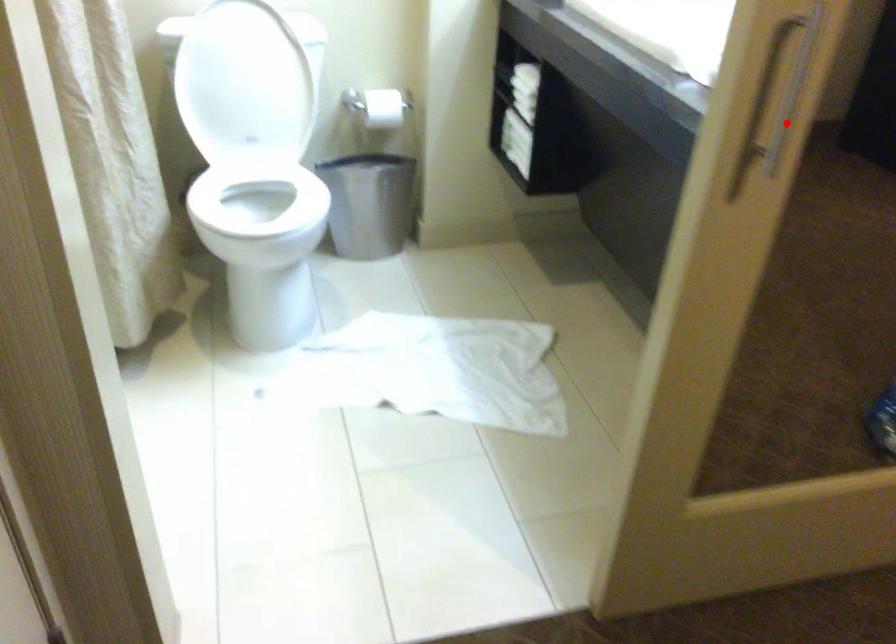
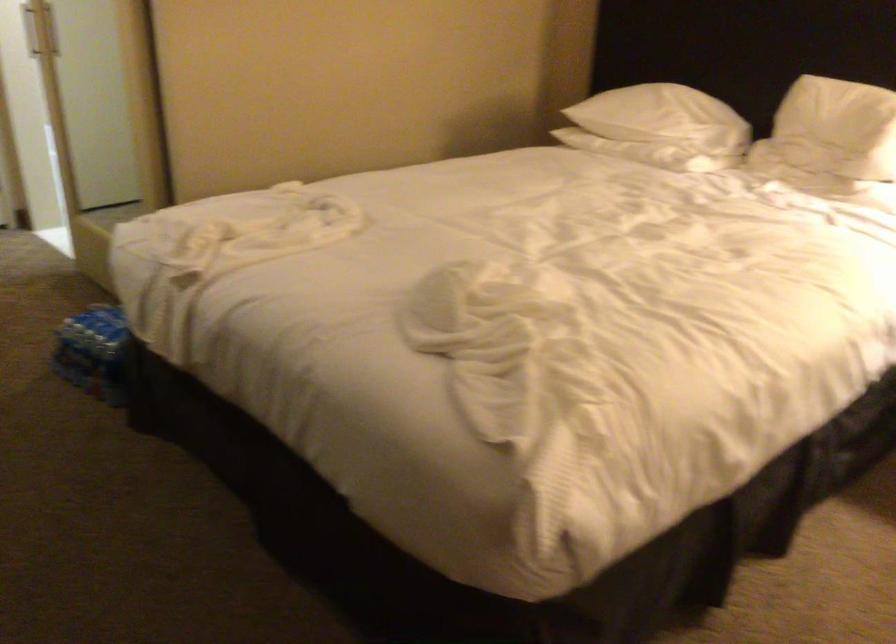
Question: I am providing you with two images of the same scene from different viewpoints. Image1 has a red point marked. In image2, the corresponding 3D location appears at what relative position? Reply with the corresponding letter.

Choices:
 (A) Closer
 (B) Farther

Answer: (B)